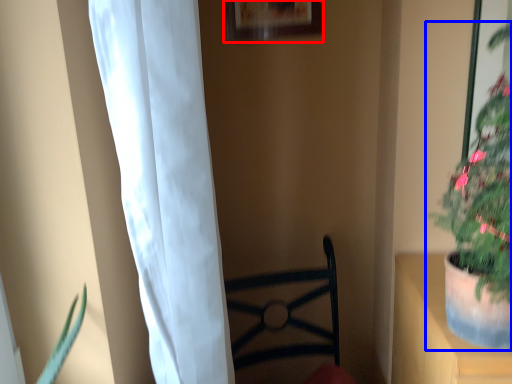
Question: Which object is closer to the camera taking this photo, picture frame (highlighted by a red box) or houseplant (highlighted by a blue box)?

Choices:
 (A) picture frame
 (B) houseplant

Answer: (B)